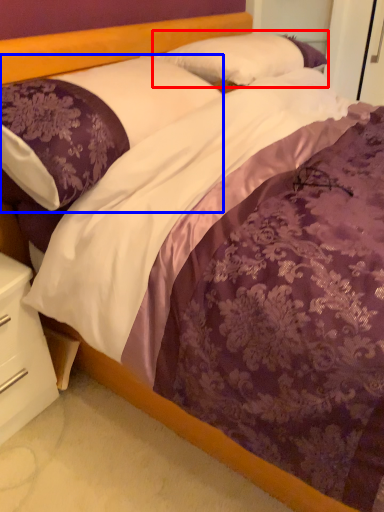
Question: Among these objects, which one is farthest to the camera, pillow (highlighted by a red box) or pillow (highlighted by a blue box)?

Choices:
 (A) pillow
 (B) pillow

Answer: (A)